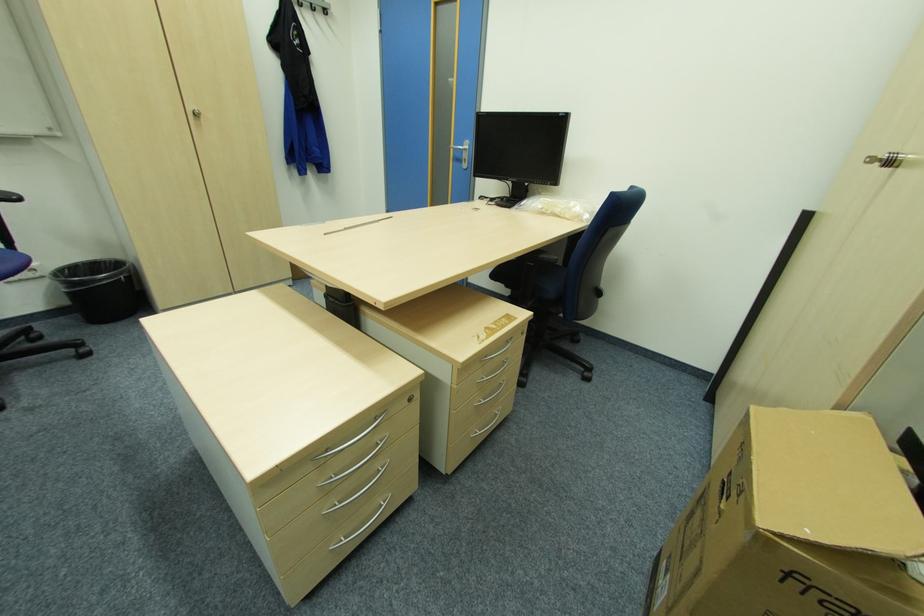
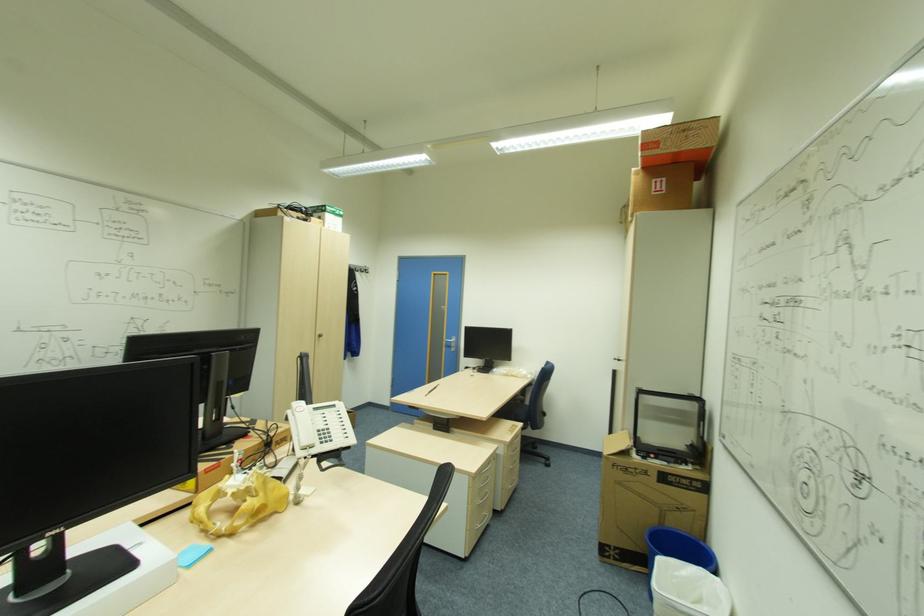
Which direction would the cameraman need to move to produce the second image?

The cameraman walked toward left, backward.